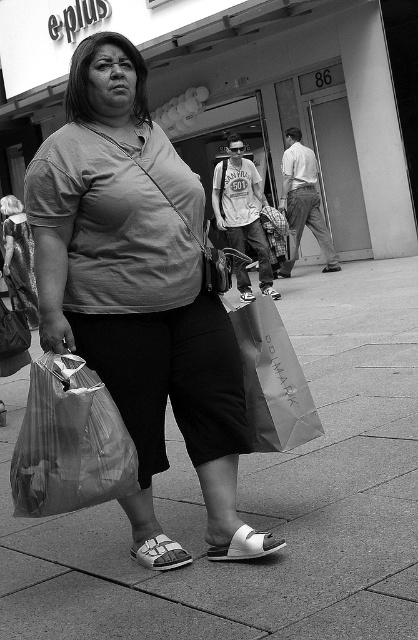
Question: Is translucent plastic bag at lower left wider than matte paper bag at center?

Choices:
 (A) no
 (B) yes

Answer: (B)

Question: Which object appears closest to the camera in this image?

Choices:
 (A) matte gray shirt at center
 (B) smooth concrete sidewalk at center
 (C) matte paper bag at center

Answer: (B)

Question: Estimate the real-world distances between objects in this image. Which object is farther from the matte gray shirt at center?

Choices:
 (A) translucent plastic bag at lower left
 (B) smooth concrete sidewalk at center

Answer: (B)

Question: Considering the real-world distances, which object is closest to the matte gray shirt at center?

Choices:
 (A) matte paper bag at center
 (B) translucent plastic bag at lower left
 (C) smooth concrete sidewalk at center

Answer: (B)

Question: Does matte gray shirt at center come behind matte paper bag at center?

Choices:
 (A) yes
 (B) no

Answer: (B)

Question: Is smooth concrete sidewalk at center positioned in front of translucent plastic bag at lower left?

Choices:
 (A) no
 (B) yes

Answer: (B)